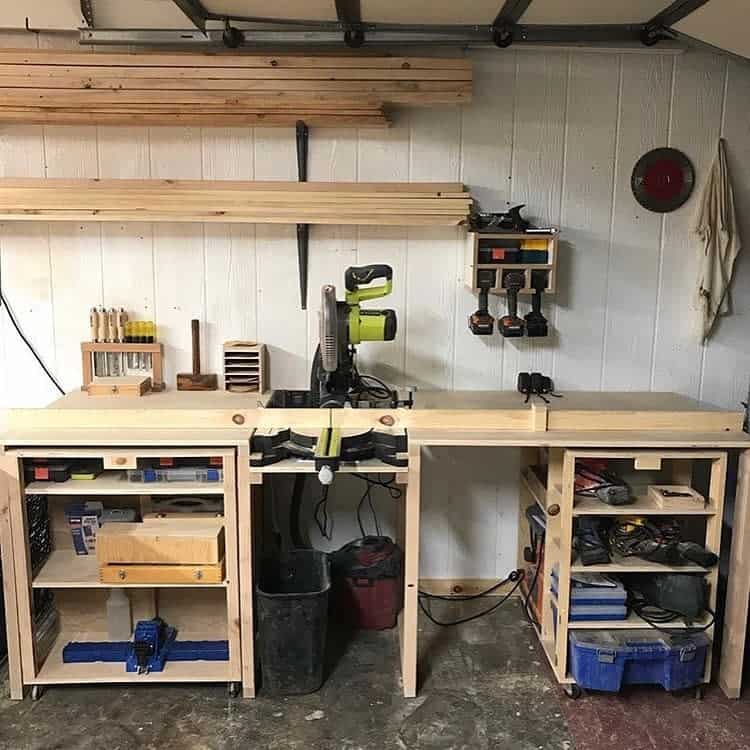
You are a GUI agent. You are given a task and a screenshot of the screen. Output one action in this format:
    pyautogui.click(x=<x>, y=<y>)
    Task: Click on the wood panel
    
    Given the screenshot: What is the action you would take?
    pyautogui.click(x=548, y=124)